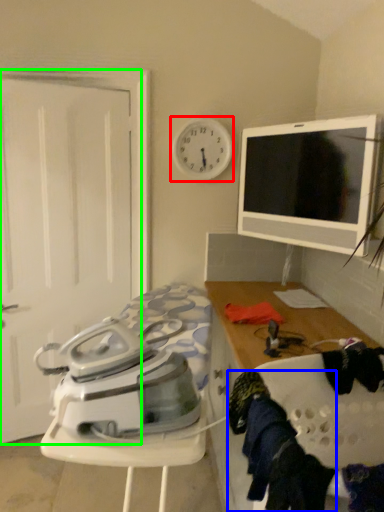
Question: Based on their relative distances, which object is nearer to clock (highlighted by a red box)? Choose from clothing (highlighted by a blue box) and screen door (highlighted by a green box).

Choices:
 (A) clothing
 (B) screen door

Answer: (B)